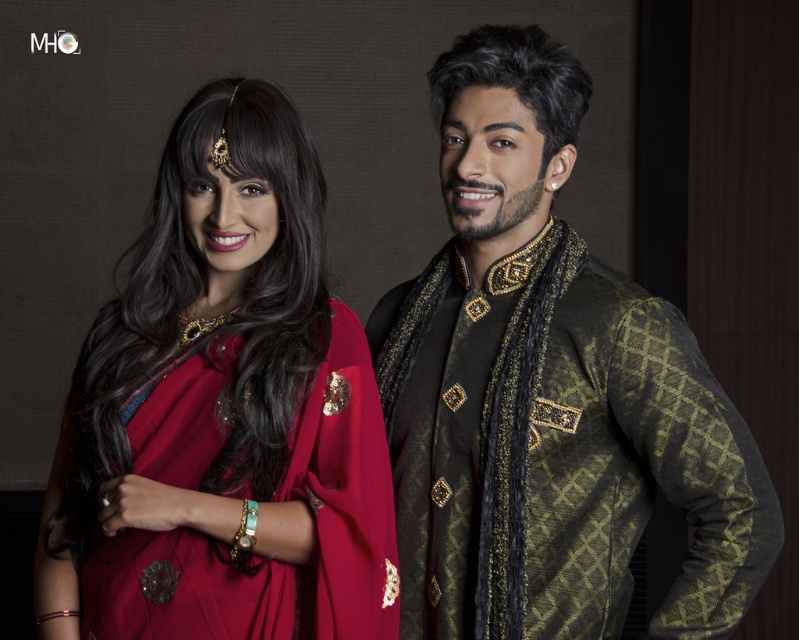
Question: Where is metallic gold and black sherwani at center located in relation to matte red sari at left in the image?

Choices:
 (A) below
 (B) above

Answer: (A)

Question: Can you confirm if metallic gold and black sherwani at center is positioned above matte red sari at left?

Choices:
 (A) no
 (B) yes

Answer: (A)

Question: Is metallic gold and black sherwani at center positioned at the back of matte red sari at left?

Choices:
 (A) yes
 (B) no

Answer: (A)